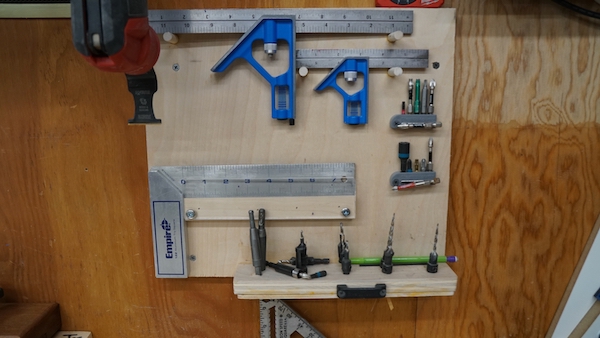
This screenshot has height=338, width=600. I want to click on handle, so point(351,288).